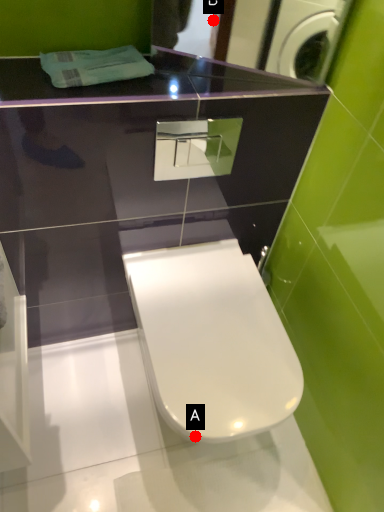
Question: Two points are circled on the image, labeled by A and B beside each circle. Which point is farther to the camera?

Choices:
 (A) A is further
 (B) B is further

Answer: (B)